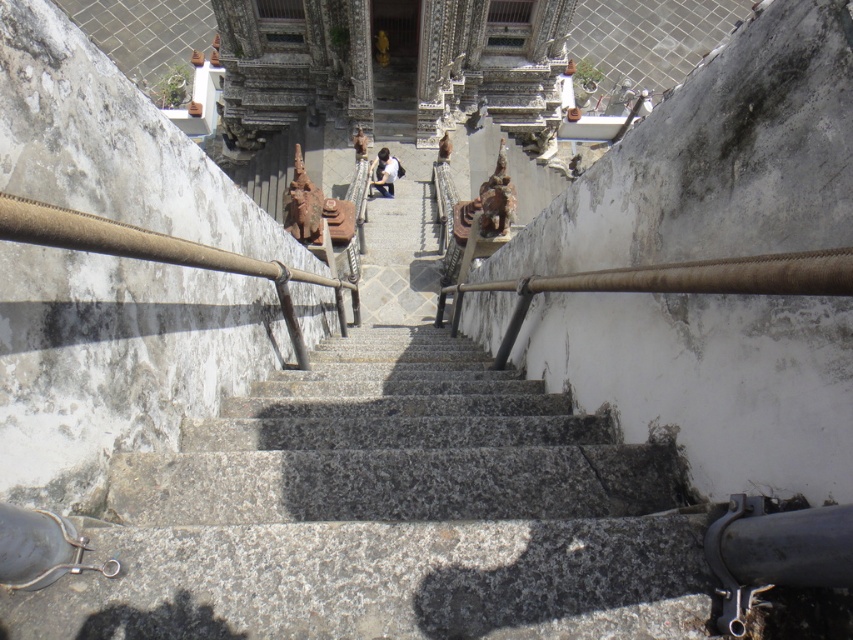
You are a maintenance worker needing to reach the top of the granite stairs at center. Your ladder is 3 meters long. If you place the ladder against the stairs, will it be long enough to reach the top?

The granite stairs at center and viewer are 2.94 meters apart from each other. Since the ladder is 3 meters long, it will be slightly longer than the distance needed, so yes, the ladder will be long enough to reach the top.